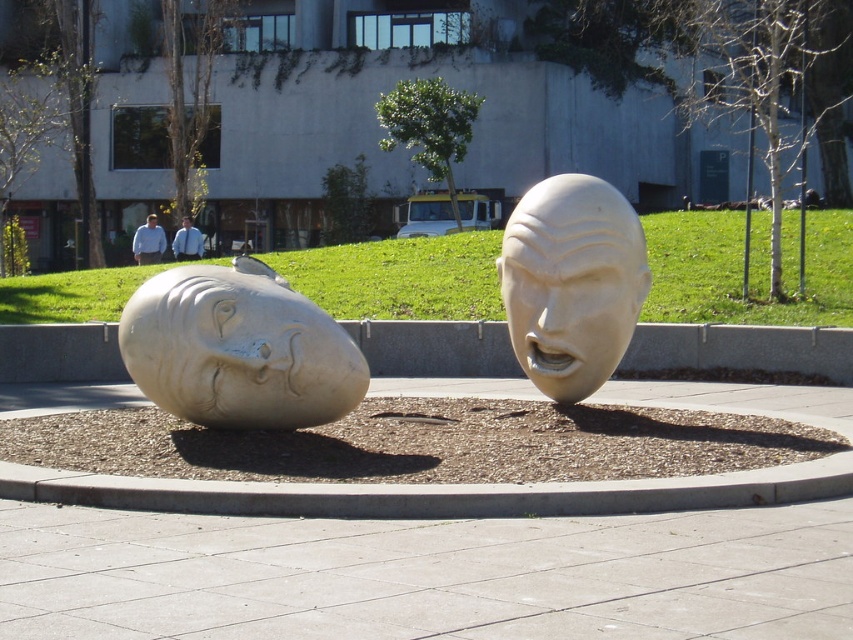
Question: From the image, what is the correct spatial relationship of white stone head at left in relation to white marble head at center?

Choices:
 (A) above
 (B) below

Answer: (B)

Question: Can you confirm if white stone head at left is positioned to the left of white marble head at center?

Choices:
 (A) yes
 (B) no

Answer: (A)

Question: From the image, what is the correct spatial relationship of white stone head at left in relation to white marble head at center?

Choices:
 (A) left
 (B) right

Answer: (A)

Question: Among these objects, which one is nearest to the camera?

Choices:
 (A) white stone head at left
 (B) white marble head at center

Answer: (A)